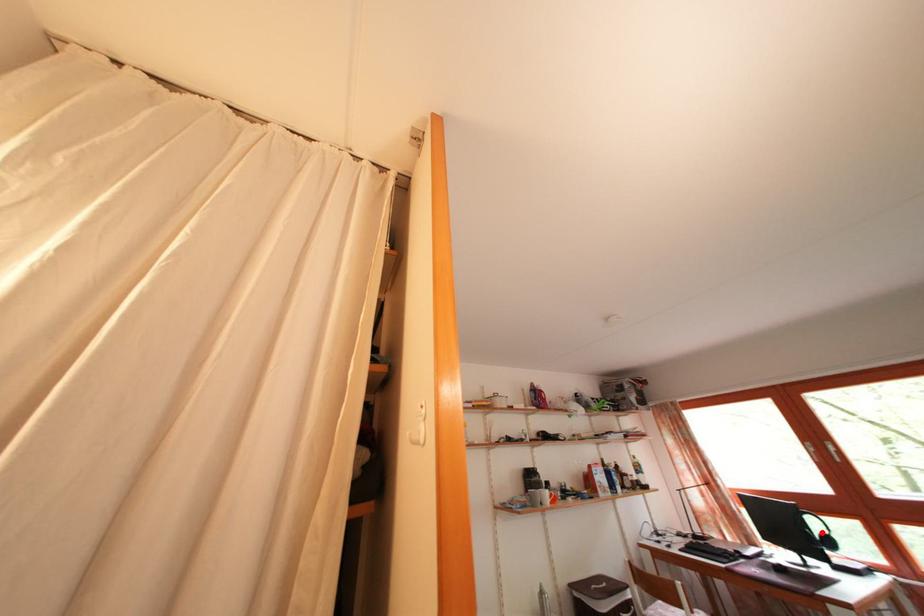
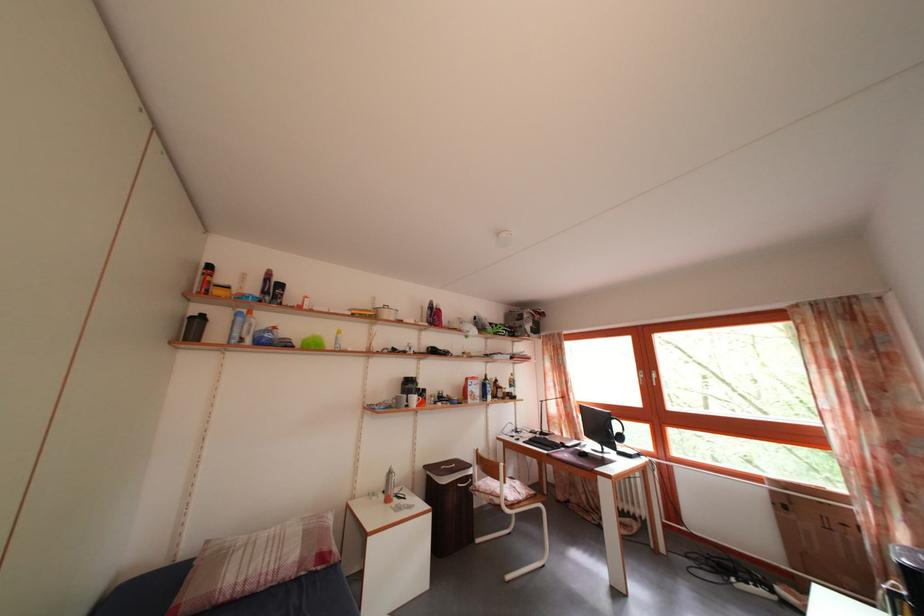
Where in the second image is the point corresponding to the highlighted location from the first image?

(624, 434)